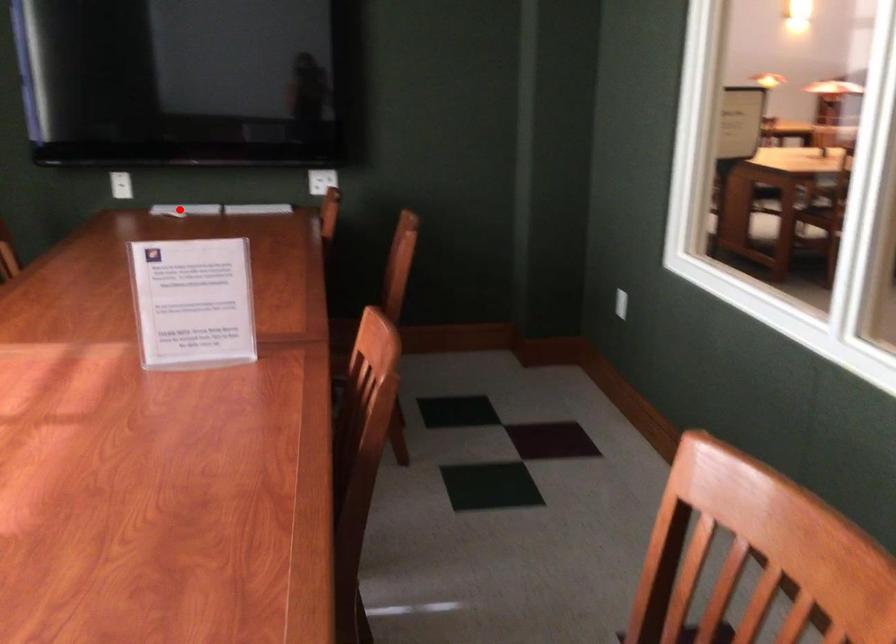
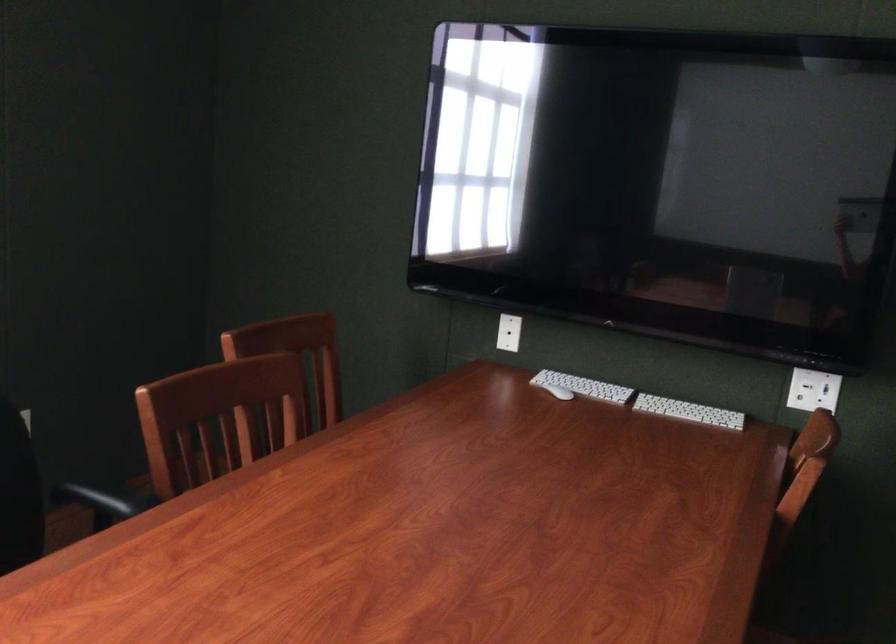
Question: A red point is marked in image1. In image2, is the corresponding 3D point closer to the camera or farther? Reply with the corresponding letter.

Choices:
 (A) The corresponding 3D point is closer.
 (B) The corresponding 3D point is farther.

Answer: (A)